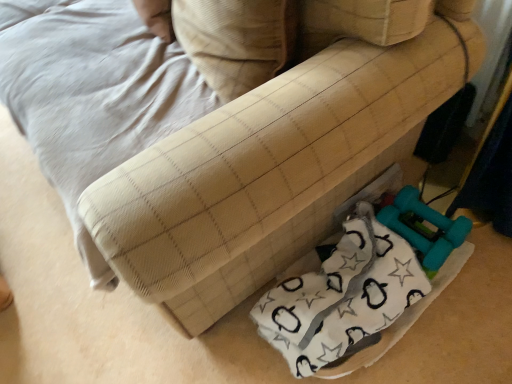
Question: Considering the positions of beige fabric pillow at center and white fabric at lower right in the image, is beige fabric pillow at center wider or thinner than white fabric at lower right?

Choices:
 (A) thin
 (B) wide

Answer: (A)

Question: Visually, is beige fabric pillow at center positioned to the left or to the right of white fabric at lower right?

Choices:
 (A) right
 (B) left

Answer: (B)

Question: In terms of size, does beige fabric pillow at center appear bigger or smaller than white fabric at lower right?

Choices:
 (A) small
 (B) big

Answer: (A)

Question: Looking at their shapes, would you say white fabric at lower right is wider or thinner than beige fabric pillow at center?

Choices:
 (A) wide
 (B) thin

Answer: (A)

Question: Is white fabric at lower right inside the boundaries of beige fabric pillow at center, or outside?

Choices:
 (A) inside
 (B) outside

Answer: (B)

Question: Is white fabric at lower right bigger or smaller than beige fabric pillow at center?

Choices:
 (A) small
 (B) big

Answer: (B)

Question: Is point (368, 226) closer or farther from the camera than point (239, 94)?

Choices:
 (A) farther
 (B) closer

Answer: (A)